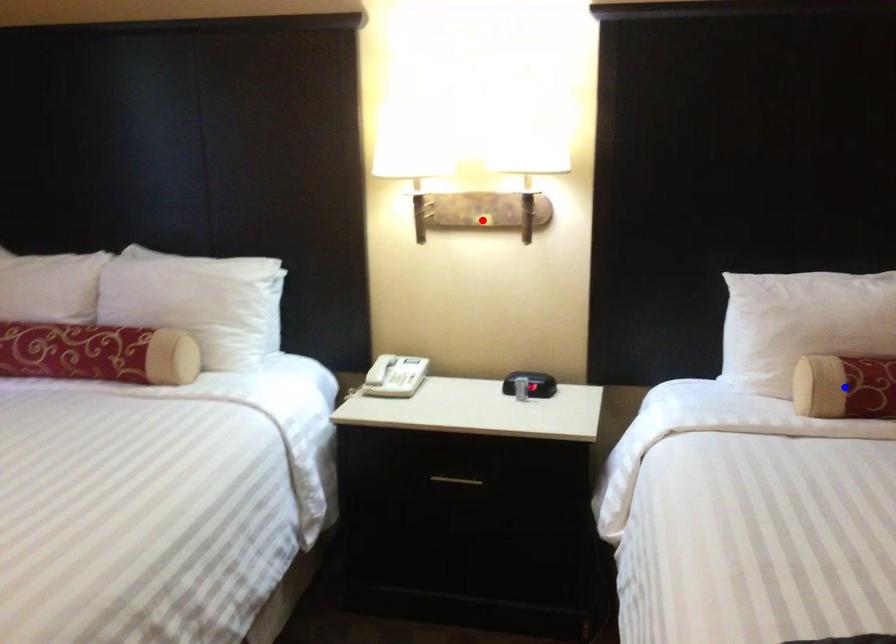
Question: Two points are marked on the image. Which point is closer to the camera?

Choices:
 (A) Blue point is closer.
 (B) Red point is closer.

Answer: (A)